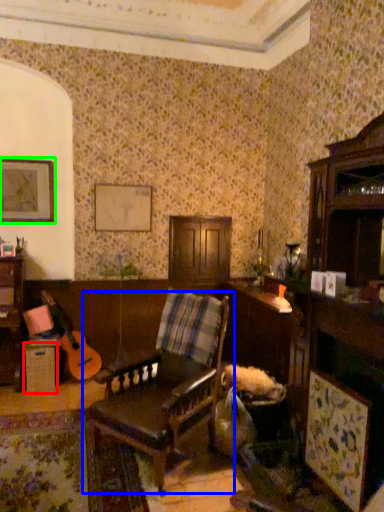
Question: Estimate the real-world distances between objects in this image. Which object is closer to table (highlighted by a red box), chair (highlighted by a blue box) or picture frame (highlighted by a green box)?

Choices:
 (A) chair
 (B) picture frame

Answer: (B)